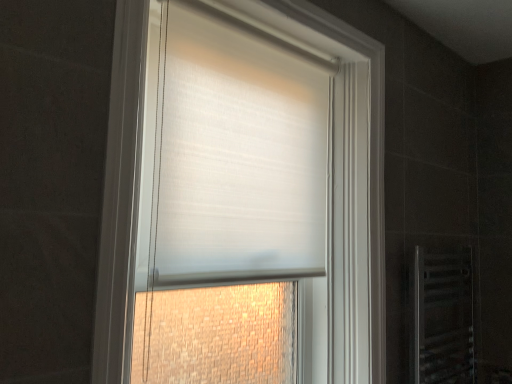
Question: From a real-world perspective, does clear plastic screen door at lower right stand above white matte roller blind at center?

Choices:
 (A) yes
 (B) no

Answer: (B)

Question: Can you confirm if clear plastic screen door at lower right is positioned to the left of white matte roller blind at center?

Choices:
 (A) no
 (B) yes

Answer: (A)

Question: Does clear plastic screen door at lower right lie in front of white matte roller blind at center?

Choices:
 (A) no
 (B) yes

Answer: (A)

Question: Considering the relative sizes of clear plastic screen door at lower right and white matte roller blind at center in the image provided, is clear plastic screen door at lower right thinner than white matte roller blind at center?

Choices:
 (A) no
 (B) yes

Answer: (B)

Question: Considering the relative sizes of clear plastic screen door at lower right and white matte roller blind at center in the image provided, is clear plastic screen door at lower right taller than white matte roller blind at center?

Choices:
 (A) yes
 (B) no

Answer: (B)

Question: Relative to white sheer blind at center, is clear plastic screen door at lower right in front or behind?

Choices:
 (A) front
 (B) behind

Answer: (B)

Question: In terms of size, does clear plastic screen door at lower right appear bigger or smaller than white sheer blind at center?

Choices:
 (A) small
 (B) big

Answer: (A)

Question: Is clear plastic screen door at lower right wider or thinner than white sheer blind at center?

Choices:
 (A) thin
 (B) wide

Answer: (A)

Question: From a real-world perspective, is clear plastic screen door at lower right positioned above or below white sheer blind at center?

Choices:
 (A) above
 (B) below

Answer: (B)

Question: In the image, is clear plastic screen door at lower right positioned in front of or behind white matte roller blind at center?

Choices:
 (A) behind
 (B) front

Answer: (A)

Question: From a real-world perspective, is clear plastic screen door at lower right physically located above or below white matte roller blind at center?

Choices:
 (A) below
 (B) above

Answer: (A)

Question: Is point (420, 362) positioned closer to the camera than point (297, 3)?

Choices:
 (A) closer
 (B) farther

Answer: (B)

Question: Choose the correct answer: Is clear plastic screen door at lower right inside white matte roller blind at center or outside it?

Choices:
 (A) outside
 (B) inside

Answer: (A)

Question: Considering the positions of point (124, 218) and point (199, 278), is point (124, 218) closer or farther from the camera than point (199, 278)?

Choices:
 (A) closer
 (B) farther

Answer: (A)

Question: Relative to white sheer blind at center, is white matte roller blind at center in front or behind?

Choices:
 (A) behind
 (B) front

Answer: (B)